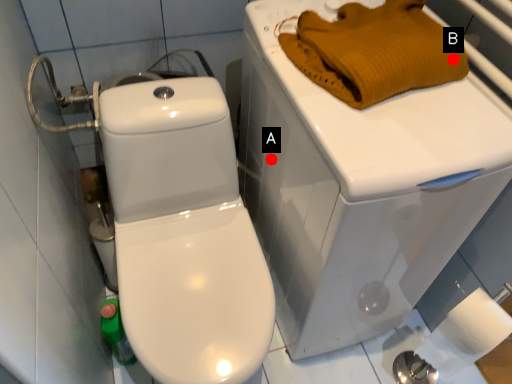
Question: Two points are circled on the image, labeled by A and B beside each circle. Among these points, which one is farthest from the camera?

Choices:
 (A) A is further
 (B) B is further

Answer: (A)